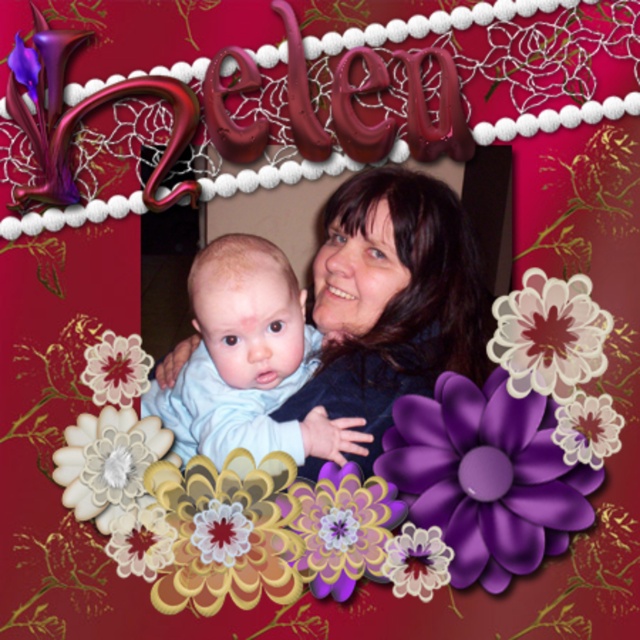
You are standing in front of the framed photograph. A small sticker is placed at point (202,394) on the frame. If you want to reach this sticker without moving your feet, can you do it with your hand stretched out?

The point (202,394) is 3.76 feet away from the viewer. Since the average arm length is about 2.5 feet, you cannot reach the sticker without moving your feet.

You are an interior designer arranging flowers in a vase. You have two purple matte flowers. One is labeled as the purple matte flower at center and the other as the matte purple flower at center. Which one should you place in the vase if you want the larger flower to be more prominent?

The purple matte flower at center should be placed in the vase because it has a larger size compared to the matte purple flower at center.

You are standing in front of the framed photograph. There are two points marked on the frame. The first point is at coordinates point (289, 356) and the second point is at point (560, 433). Which point is closer to you?

Point (560, 433) is closer to you because point (289, 356) is behind it.